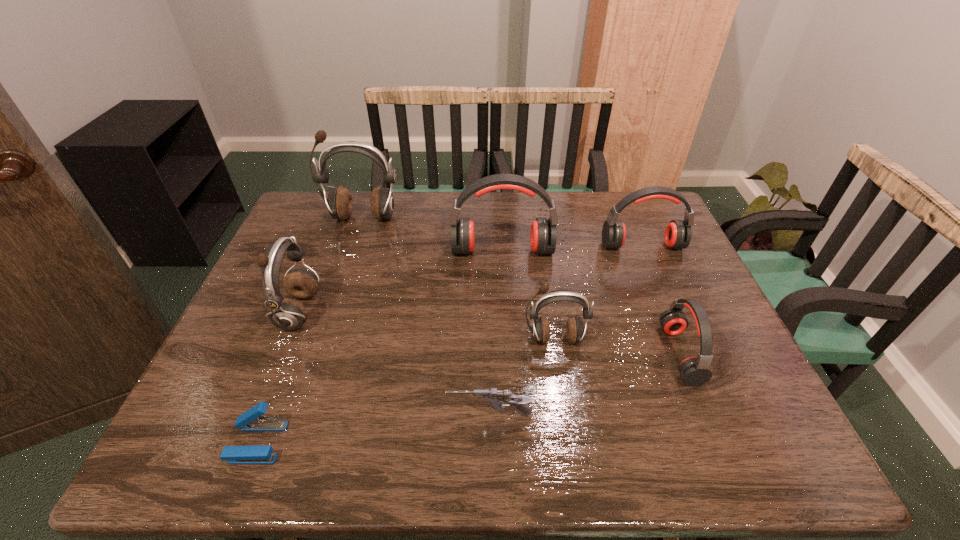
Image resolution: width=960 pixels, height=540 pixels. In order to click on the tallest earphone in this screenshot , I will do `click(340, 204)`.

Locate an element on the screen. This screenshot has height=540, width=960. the farthest object is located at coordinates (340, 204).

Locate an element on the screen. the biggest red earphone is located at coordinates (543, 235).

Find the location of a particular element. The image size is (960, 540). the second smallest brown earphone is located at coordinates (287, 314).

Image resolution: width=960 pixels, height=540 pixels. What are the coordinates of `the second biggest red earphone` in the screenshot? It's located at (678, 233).

The height and width of the screenshot is (540, 960). What are the coordinates of `the rightmost brown earphone` in the screenshot? It's located at (540, 329).

Identify the location of the shortest earphone. This screenshot has height=540, width=960. (695, 371).

Locate an element on the screen. the sixth tallest object is located at coordinates (695, 371).

What are the coordinates of `gun` in the screenshot? It's located at (496, 398).

This screenshot has height=540, width=960. Find the location of `the nearest object`. the nearest object is located at coordinates (252, 420).